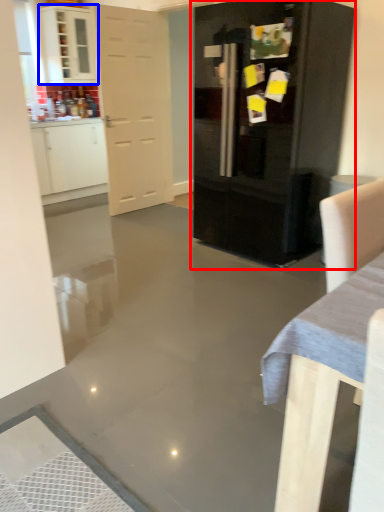
Question: Which of the following is the closest to the observer, cupboard (highlighted by a red box) or cabinetry (highlighted by a blue box)?

Choices:
 (A) cupboard
 (B) cabinetry

Answer: (A)